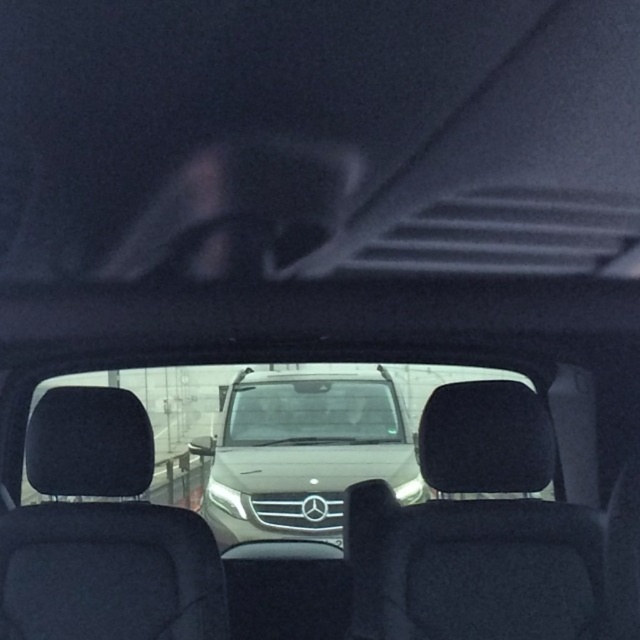
Question: Which of the following is the farthest from the observer?

Choices:
 (A) (532, 465)
 (B) (312, 444)

Answer: (B)

Question: Which of the following is the closest to the observer?

Choices:
 (A) (328, 416)
 (B) (406, 467)
 (C) (49, 465)
 (D) (540, 403)

Answer: (C)

Question: Can you confirm if black fabric rearview mirror at center is smaller than suede-like black rearview mirror at left?

Choices:
 (A) no
 (B) yes

Answer: (B)

Question: Which object appears farthest from the camera in this image?

Choices:
 (A) satin gold suv at center
 (B) black fabric rearview mirror at center

Answer: (A)

Question: Does satin gold suv at center appear over suede-like black rearview mirror at left?

Choices:
 (A) yes
 (B) no

Answer: (B)

Question: Is satin gold suv at center bigger than clear glass windshield at center?

Choices:
 (A) yes
 (B) no

Answer: (A)